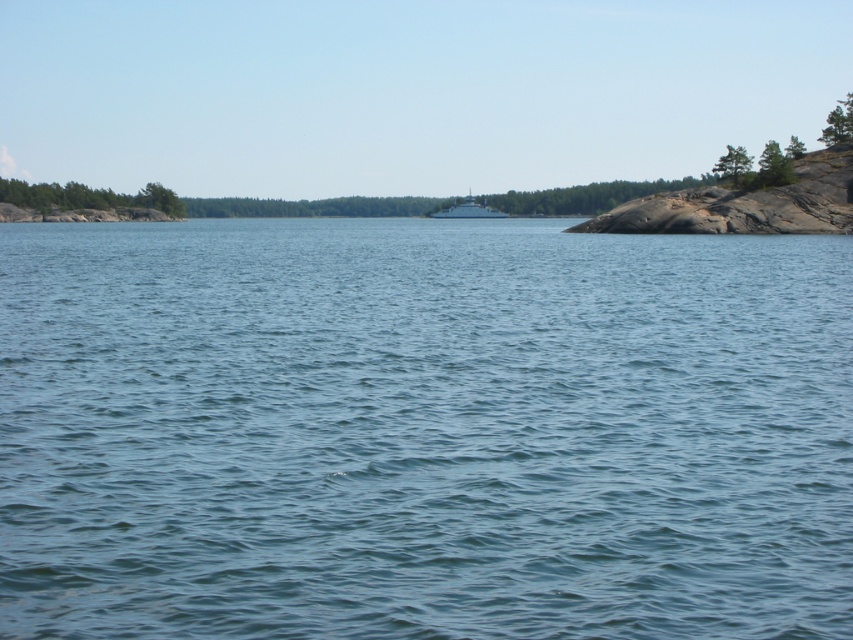
Who is lower down, blue water at center or white glossy boat at center?

blue water at center

Does blue water at center appear under white glossy boat at center?

Correct, blue water at center is located below white glossy boat at center.

Where is `blue water at center`? The image size is (853, 640). blue water at center is located at coordinates (422, 429).